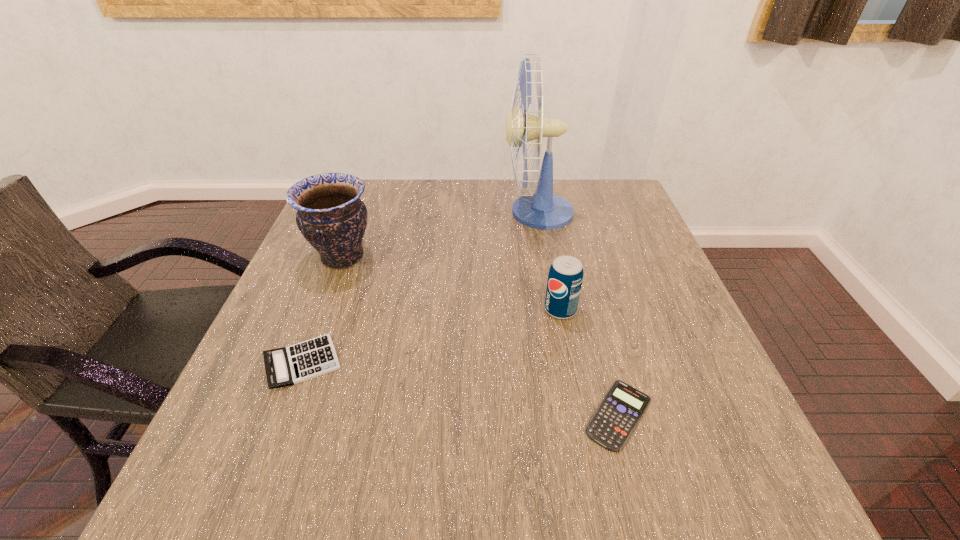
The height and width of the screenshot is (540, 960). In order to click on free space at the near edge of the desktop in this screenshot , I will do `click(612, 461)`.

Image resolution: width=960 pixels, height=540 pixels. Find the location of `free space at the right edge of the desktop`. free space at the right edge of the desktop is located at coordinates (732, 415).

Where is `free space at the near left corner`? The width and height of the screenshot is (960, 540). free space at the near left corner is located at coordinates (297, 472).

The image size is (960, 540). In the image, there is a desktop. What are the coordinates of `free space at the far right corner` in the screenshot? It's located at (618, 197).

The height and width of the screenshot is (540, 960). What are the coordinates of `empty location between the shortest object and the taller calculator` in the screenshot? It's located at (461, 389).

Find the location of a particular element. The width and height of the screenshot is (960, 540). empty location between the shortest object and the tallest object is located at coordinates (578, 314).

Identify the location of vacant point located between the fan and the third farthest object. The image size is (960, 540). (549, 261).

Find the location of a particular element. The image size is (960, 540). vacant area between the third farthest object and the shortest object is located at coordinates (589, 362).

Locate an element on the screen. The width and height of the screenshot is (960, 540). vacant space that is in between the tallest object and the fourth tallest object is located at coordinates (420, 287).

Where is `free space between the taller calculator and the shorter calculator`? This screenshot has height=540, width=960. free space between the taller calculator and the shorter calculator is located at coordinates (461, 389).